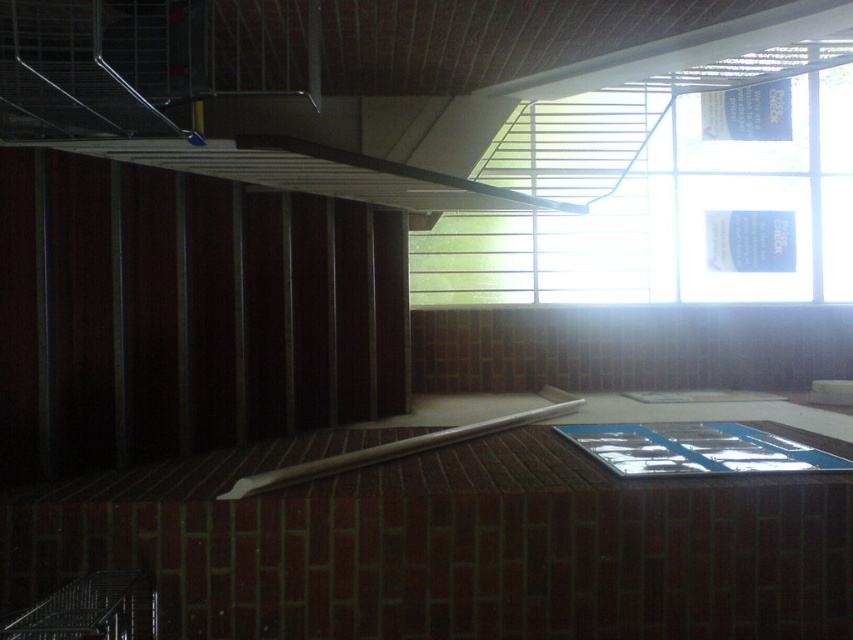
You are standing in the room and want to reach the clear glass window at upper right. If your maximum reach is 1.8 meters, can you touch it without moving closer?

The clear glass window at upper right is 4.93 meters away from you, which is much farther than your 1.8 meter reach. You cannot touch it without moving closer.

You are a delivery person carrying a package that is 2 meters long. You need to move it through the space between the clear glass window at upper right and the white wood beam at center. Can you fit the package through that space?

The distance between the clear glass window at upper right and the white wood beam at center is 1.99 meters, which is slightly less than the 2 meter length of the package. Therefore, the package cannot fit through that space.

You are an interior designer assessing the space. You need to place a large poster that requires a flat, unobstructed surface. Which object between the clear glass window at upper right and the white wood beam at center would be suitable for this purpose?

The clear glass window at upper right has a larger size compared to the white wood beam at center, making it more suitable for placing a large poster that requires a flat, unobstructed surface.